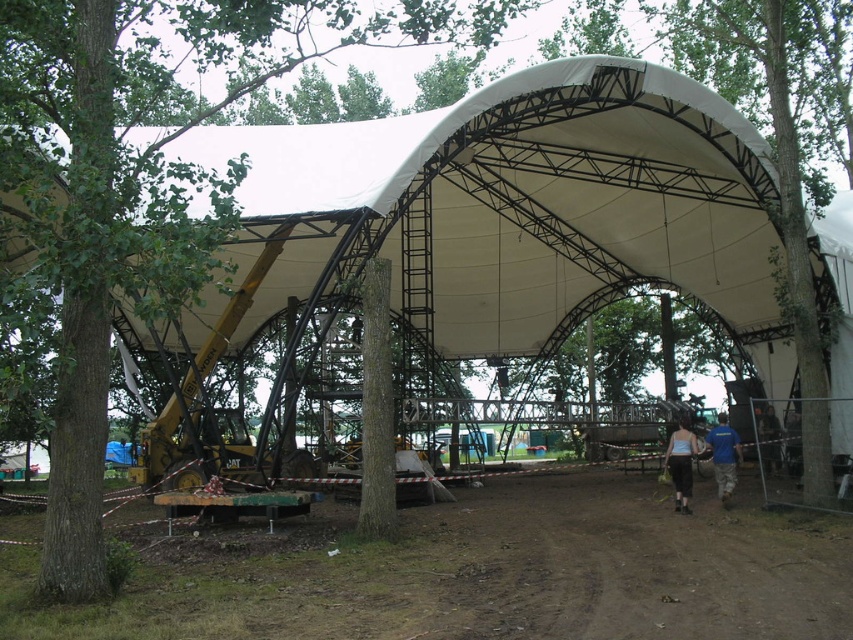
Question: Is green leafy tree at left further to the viewer compared to blue fabric shirt at center?

Choices:
 (A) yes
 (B) no

Answer: (B)

Question: Is dark gray fabric pants at center wider than blue fabric shirt at center?

Choices:
 (A) yes
 (B) no

Answer: (B)

Question: Which point appears closest to the camera in this image?

Choices:
 (A) (733, 488)
 (B) (21, 108)
 (C) (189, 595)
 (D) (780, 432)

Answer: (C)

Question: Does green leafy tree at left have a smaller size compared to dark blue shirt at lower right?

Choices:
 (A) yes
 (B) no

Answer: (B)

Question: Which object is positioned farthest from the dark blue shirt at lower right?

Choices:
 (A) green leafy tree at left
 (B) brown dirt track at lower center
 (C) dark gray fabric pants at center

Answer: (A)

Question: Which object is positioned closest to the dark gray fabric pants at center?

Choices:
 (A) brown dirt track at lower center
 (B) blue fabric shirt at center

Answer: (B)